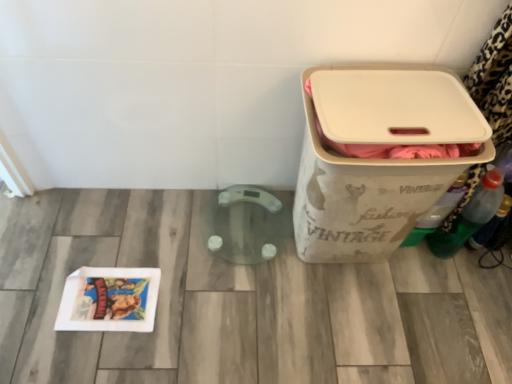
Question: Can you confirm if translucent plastic bottle at right, the first bottle when ordered from right to left, is thinner than green plastic bottle at right, arranged as the second bottle when viewed from the right?

Choices:
 (A) no
 (B) yes

Answer: (B)

Question: Can you confirm if translucent plastic bottle at right, marked as the 3th bottle in a left-to-right arrangement, is wider than green plastic bottle at right, the 2th bottle viewed from the left?

Choices:
 (A) yes
 (B) no

Answer: (B)

Question: Is translucent plastic bottle at right, the first bottle when ordered from right to left, aimed at green plastic bottle at right, arranged as the second bottle when viewed from the right?

Choices:
 (A) yes
 (B) no

Answer: (B)

Question: Is translucent plastic bottle at right, the first bottle when ordered from right to left, taller than green plastic bottle at right, the 2th bottle viewed from the left?

Choices:
 (A) no
 (B) yes

Answer: (A)

Question: Is translucent plastic bottle at right, the first bottle when ordered from right to left, far from green plastic bottle at right, arranged as the second bottle when viewed from the right?

Choices:
 (A) no
 (B) yes

Answer: (A)

Question: From the image's perspective, does translucent plastic bottle at right, marked as the 3th bottle in a left-to-right arrangement, appear lower than green plastic bottle at right, arranged as the second bottle when viewed from the right?

Choices:
 (A) yes
 (B) no

Answer: (A)

Question: Is green plastic bottle at right, the 2th bottle viewed from the left, to the left of beige fabric storage bin at right from the viewer's perspective?

Choices:
 (A) yes
 (B) no

Answer: (B)

Question: From a real-world perspective, does green plastic bottle at right, the 2th bottle viewed from the left, sit lower than beige fabric storage bin at right?

Choices:
 (A) yes
 (B) no

Answer: (A)

Question: Is green plastic bottle at right, the 2th bottle viewed from the left, in front of beige fabric storage bin at right?

Choices:
 (A) no
 (B) yes

Answer: (A)

Question: From the image's perspective, does green plastic bottle at right, the 2th bottle viewed from the left, appear lower than beige fabric storage bin at right?

Choices:
 (A) no
 (B) yes

Answer: (B)

Question: Is beige fabric storage bin at right located within green plastic bottle at right, arranged as the second bottle when viewed from the right?

Choices:
 (A) yes
 (B) no

Answer: (B)

Question: Can you confirm if green plastic bottle at right, arranged as the second bottle when viewed from the right, is bigger than beige fabric storage bin at right?

Choices:
 (A) no
 (B) yes

Answer: (A)

Question: Does beige fabric storage bin at right have a larger size compared to translucent plastic bottle at right, marked as the 3th bottle in a left-to-right arrangement?

Choices:
 (A) yes
 (B) no

Answer: (A)